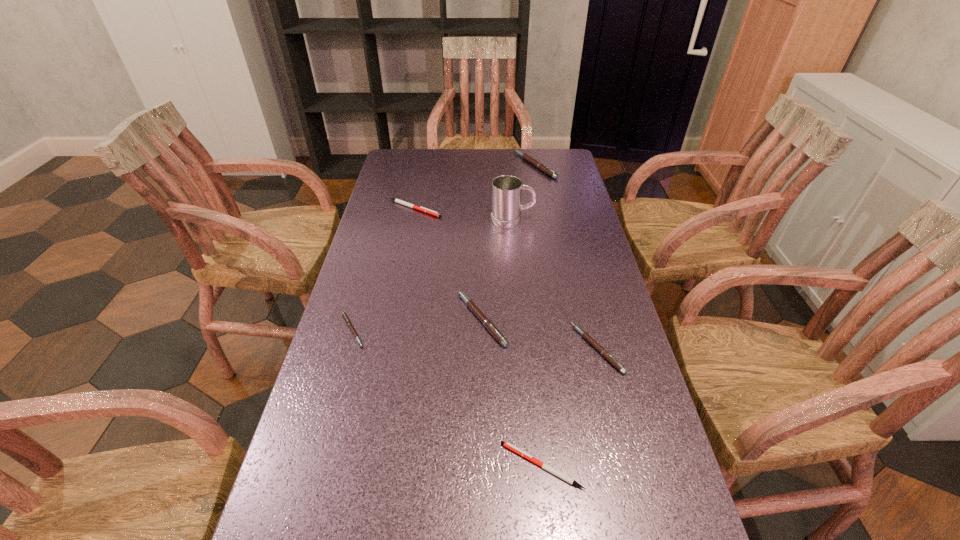
You are a GUI agent. You are given a task and a screenshot of the screen. Output one action in this format:
    pyautogui.click(x=<x>, y=<y>)
    Task: Click on the smaller white pen
    This screenshot has width=960, height=540.
    Given the screenshot: What is the action you would take?
    pyautogui.click(x=550, y=469)

Locate an element on the screen. This screenshot has height=540, width=960. the nearest pen is located at coordinates (550, 469).

What are the coordinates of `free space located on the side of the mug with the handle` in the screenshot? It's located at (582, 220).

The image size is (960, 540). Identify the location of vacant space located at the nib of the tallest pen. (461, 165).

I want to click on vacant space positioned 0.190m at the nib of the tallest pen, so click(x=468, y=165).

Where is `free location located at the nib of the tallest pen`? free location located at the nib of the tallest pen is located at coordinates (478, 165).

Locate an element on the screen. The height and width of the screenshot is (540, 960). free space located 0.100m at the nib of the third tallest object is located at coordinates (419, 319).

Identify the location of vacant area located at the nib of the third tallest object. (422, 319).

Locate an element on the screen. This screenshot has width=960, height=540. vacant space located at the nib of the third tallest object is located at coordinates (387, 319).

I want to click on free space located at the nib of the second smallest pink pen, so click(432, 349).